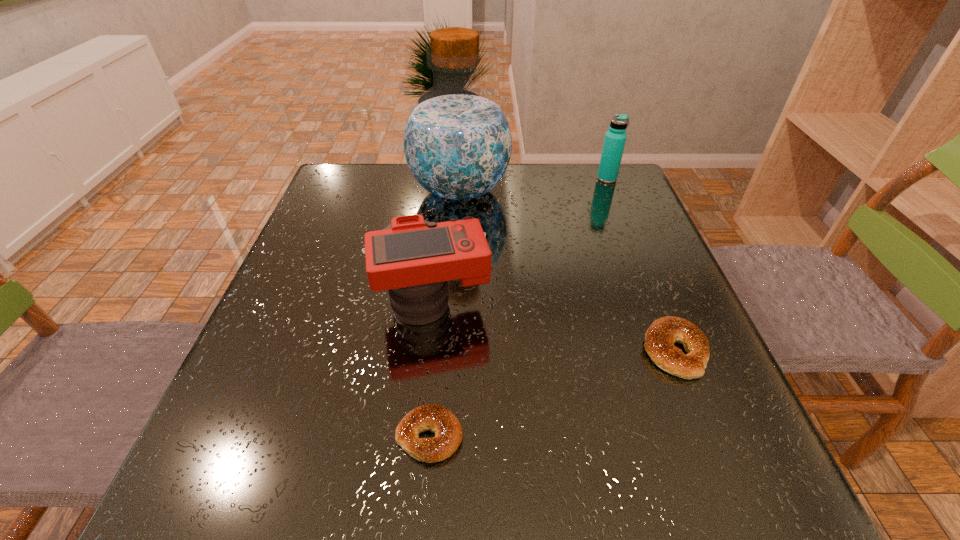
At what (x,y) coordinates should I click in order to perform the action: click on vacant area in the image that satisfies the following two spatial constraints: 1. on the back side of the water jug; 2. on the left side of the water bottle. Please return your answer as a coordinate pair (x, y). The width and height of the screenshot is (960, 540). Looking at the image, I should click on tap(461, 179).

I want to click on vacant position in the image that satisfies the following two spatial constraints: 1. on the back side of the camera; 2. on the left side of the tallest object, so click(x=444, y=191).

Identify the location of free region that satisfies the following two spatial constraints: 1. on the front side of the camera; 2. on the right side of the second shortest object. This screenshot has height=540, width=960. (426, 351).